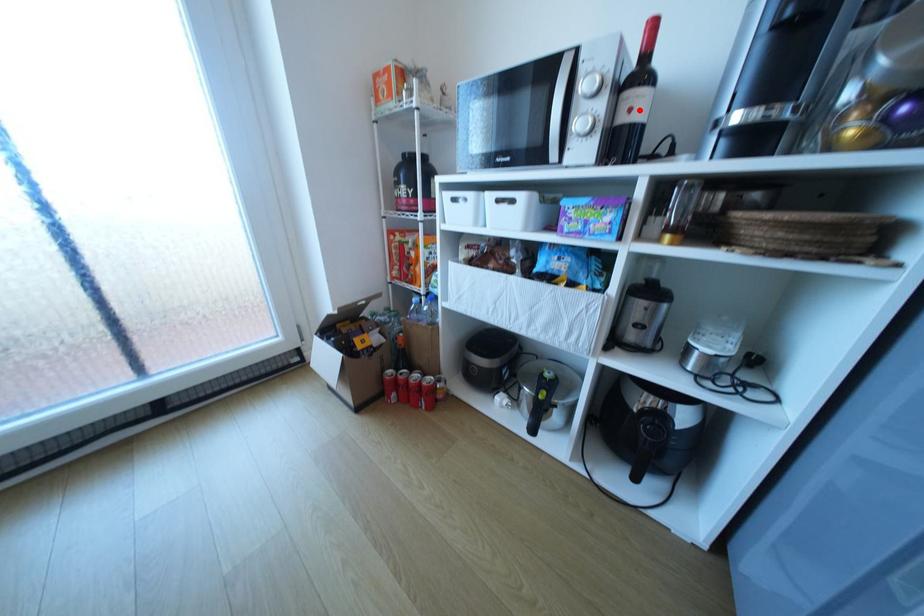
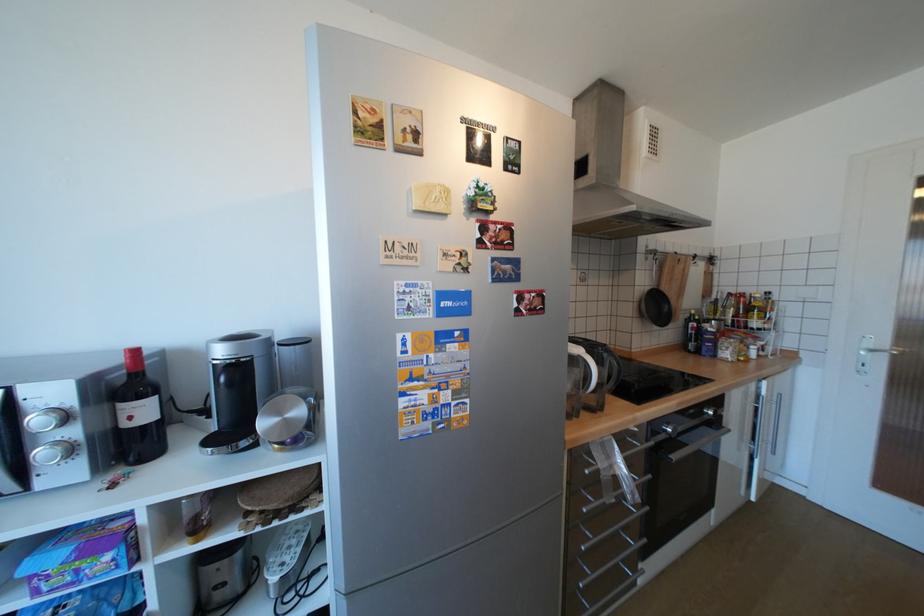
Find the pixel in the second image that matches the highlighted location in the first image.

(140, 418)